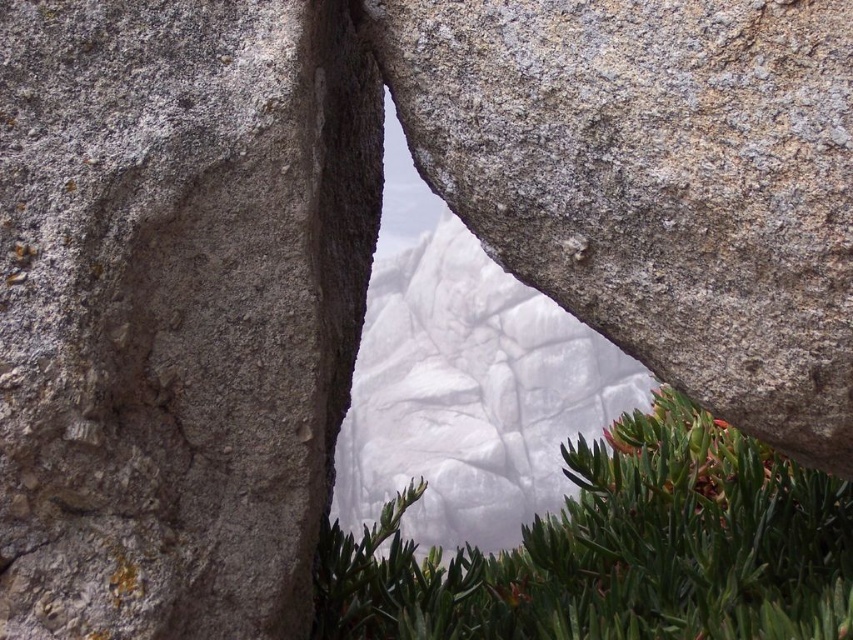
Is gray rough rock at left to the left of green leafy plant at center from the viewer's perspective?

Yes, gray rough rock at left is to the left of green leafy plant at center.

Is point (4, 100) in front of point (635, 547)?

That is True.

Find the location of `gray rough rock at left`. gray rough rock at left is located at coordinates pos(177,307).

Is gray rough rock at left above gray rough boulder at center?

Actually, gray rough rock at left is below gray rough boulder at center.

Locate an element on the screen. Image resolution: width=853 pixels, height=640 pixels. gray rough rock at left is located at coordinates (177, 307).

Is the position of gray rough boulder at center more distant than that of green leafy plant at center?

That is False.

Which of these two, gray rough boulder at center or green leafy plant at center, stands taller?

With more height is gray rough boulder at center.

Which is in front, point (589, 273) or point (672, 404)?

Point (589, 273)

Identify the location of gray rough boulder at center. (656, 180).